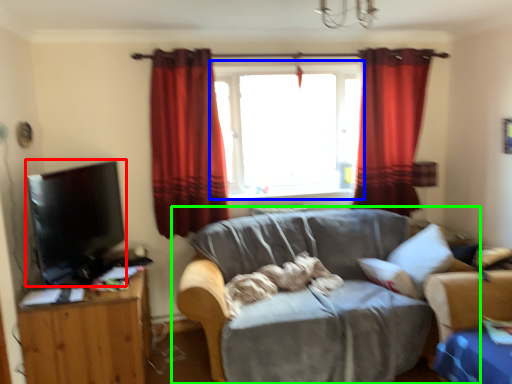
Question: Considering the real-world distances, which object is closest to flat (highlighted by a red box)? window (highlighted by a blue box) or studio couch (highlighted by a green box).

Choices:
 (A) window
 (B) studio couch

Answer: (B)